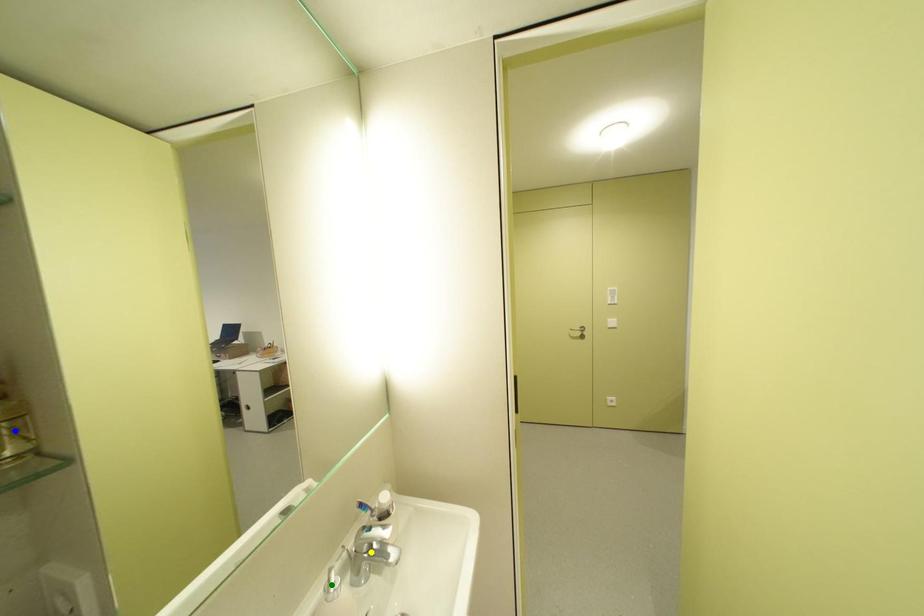
Order these from farthest to nearest:
blue point | green point | yellow point

yellow point
green point
blue point